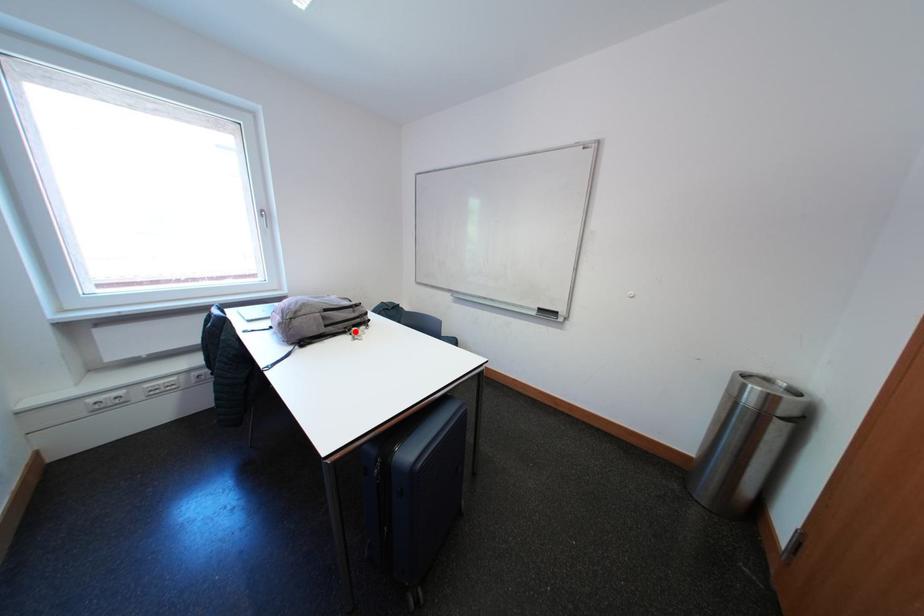
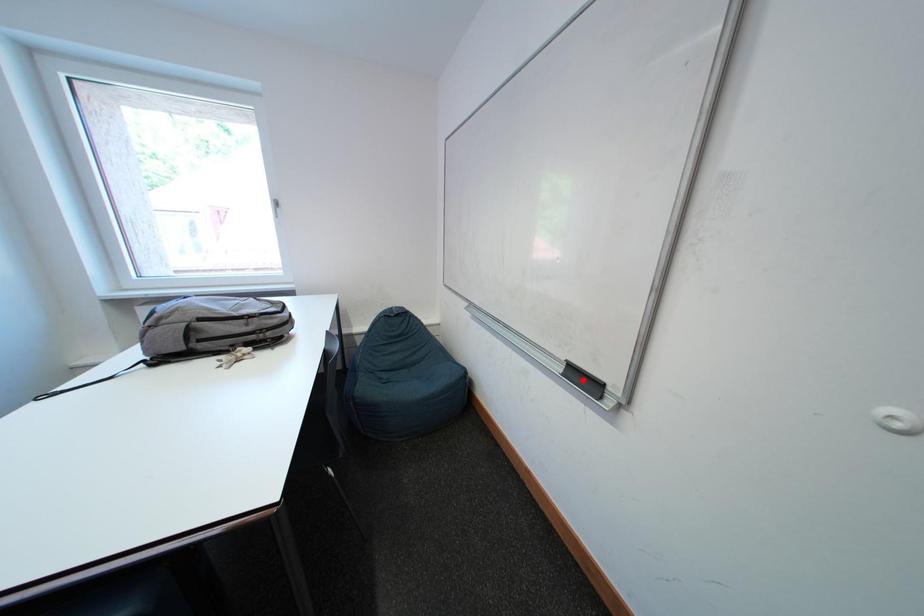
I am providing you with two images of the same scene from different viewpoints. A red point is marked on the first image and another point is marked on the second image. Is the marked point in image1 the same physical position as the marked point in image2?

No